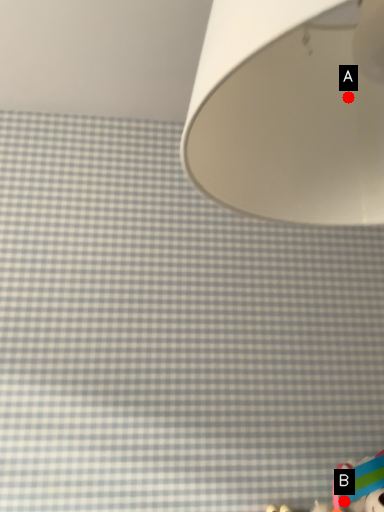
Question: Two points are circled on the image, labeled by A and B beside each circle. Which point is closer to the camera?

Choices:
 (A) A is closer
 (B) B is closer

Answer: (A)